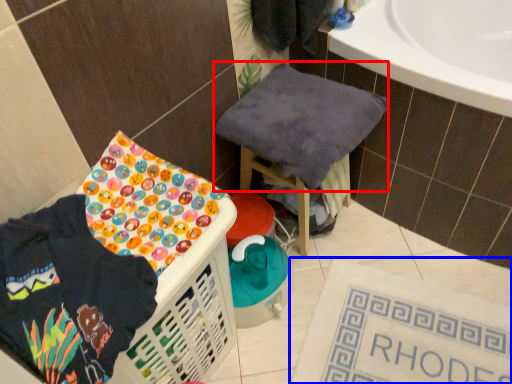
Question: Which of the following is the farthest to the observer, baby clothe (highlighted by a red box) or bath mat (highlighted by a blue box)?

Choices:
 (A) baby clothe
 (B) bath mat

Answer: (B)